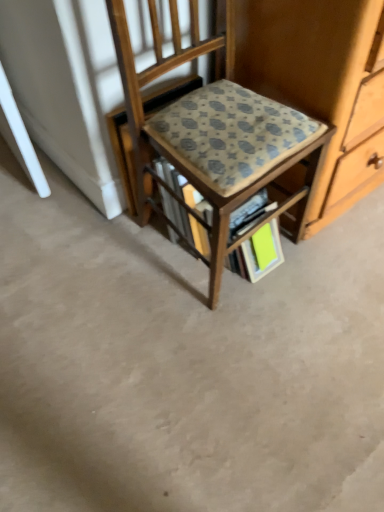
Question: From a real-world perspective, is patterned fabric chair at center on top of patterned fabric book at center?

Choices:
 (A) yes
 (B) no

Answer: (A)

Question: Considering the relative positions of patterned fabric chair at center and patterned fabric book at center in the image provided, is patterned fabric chair at center to the left of patterned fabric book at center from the viewer's perspective?

Choices:
 (A) yes
 (B) no

Answer: (A)

Question: Is patterned fabric chair at center directly adjacent to patterned fabric book at center?

Choices:
 (A) no
 (B) yes

Answer: (A)

Question: Considering the relative sizes of patterned fabric chair at center and patterned fabric book at center in the image provided, is patterned fabric chair at center bigger than patterned fabric book at center?

Choices:
 (A) no
 (B) yes

Answer: (B)

Question: Is patterned fabric chair at center closer to the viewer compared to patterned fabric book at center?

Choices:
 (A) no
 (B) yes

Answer: (B)

Question: Do you think bright green paper at lower center is within patterned fabric book at center, or outside of it?

Choices:
 (A) inside
 (B) outside

Answer: (A)

Question: In terms of height, does bright green paper at lower center look taller or shorter compared to patterned fabric book at center?

Choices:
 (A) short
 (B) tall

Answer: (A)

Question: From the image's perspective, is bright green paper at lower center located above or below patterned fabric book at center?

Choices:
 (A) below
 (B) above

Answer: (A)

Question: Does point (248, 242) appear closer or farther from the camera than point (268, 203)?

Choices:
 (A) closer
 (B) farther

Answer: (A)

Question: Would you say bright green paper at lower center is to the left or to the right of patterned fabric chair at center in the picture?

Choices:
 (A) right
 (B) left

Answer: (A)

Question: Considering the positions of point (256, 252) and point (193, 123), is point (256, 252) closer or farther from the camera than point (193, 123)?

Choices:
 (A) closer
 (B) farther

Answer: (B)

Question: Considering the positions of bright green paper at lower center and patterned fabric chair at center in the image, is bright green paper at lower center taller or shorter than patterned fabric chair at center?

Choices:
 (A) tall
 (B) short

Answer: (B)

Question: From the image's perspective, is bright green paper at lower center above or below patterned fabric chair at center?

Choices:
 (A) below
 (B) above

Answer: (A)

Question: Considering their positions, is patterned fabric chair at center located in front of or behind bright green paper at lower center?

Choices:
 (A) behind
 (B) front

Answer: (B)

Question: From the image's perspective, is patterned fabric chair at center above or below bright green paper at lower center?

Choices:
 (A) above
 (B) below

Answer: (A)